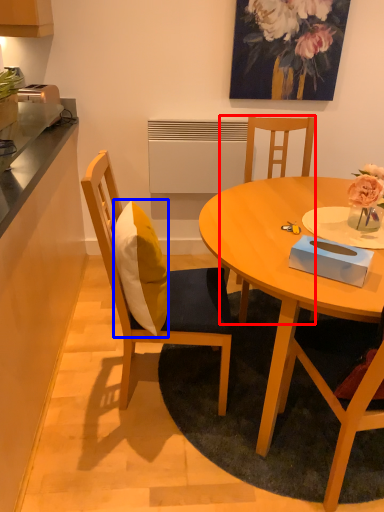
Question: Which object appears closest to the camera in this image, chair (highlighted by a red box) or pillow (highlighted by a blue box)?

Choices:
 (A) chair
 (B) pillow

Answer: (B)